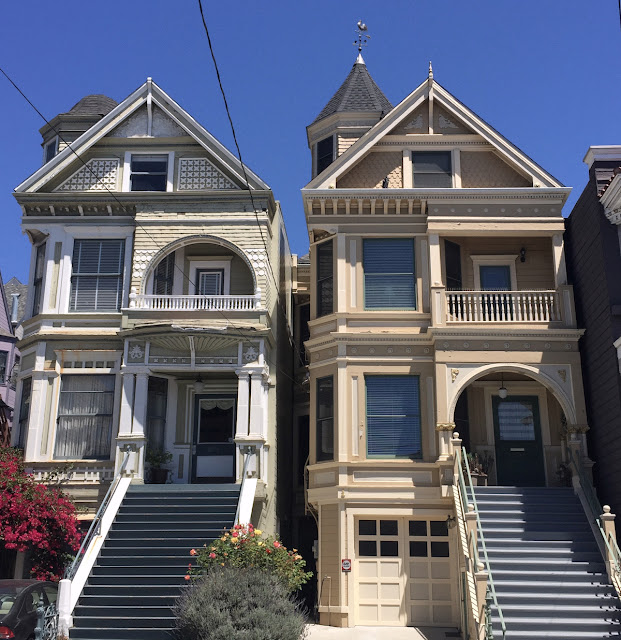
I want to click on cables, so click(230, 111), click(53, 129).